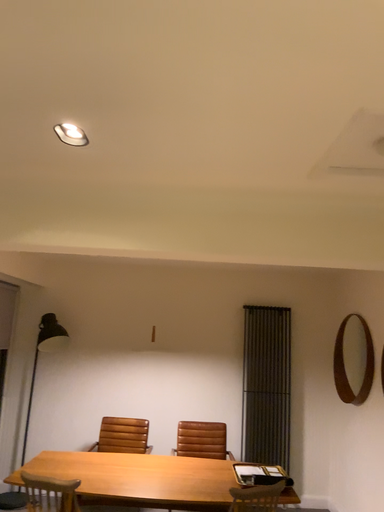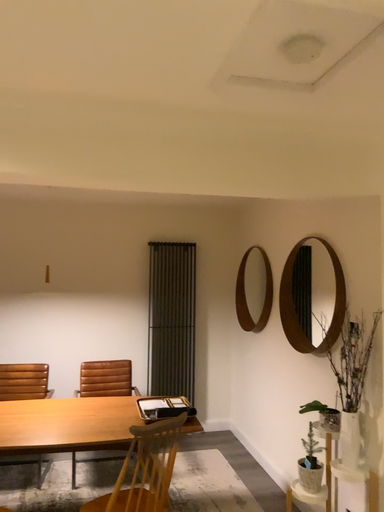
Question: Which way did the camera rotate in the video?

Choices:
 (A) rotated left
 (B) rotated right

Answer: (B)